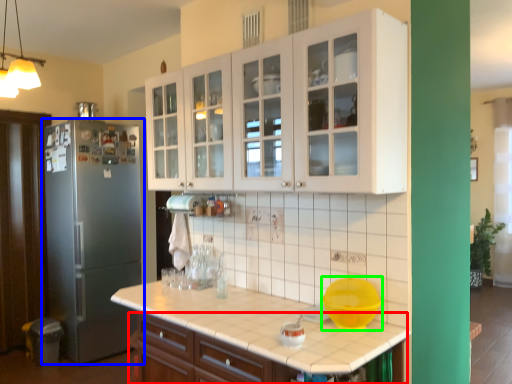
Question: Estimate the real-world distances between objects in this image. Which object is farther from cabinetry (highlighted by a red box), refrigerator (highlighted by a blue box) or mixing bowl (highlighted by a green box)?

Choices:
 (A) refrigerator
 (B) mixing bowl

Answer: (A)